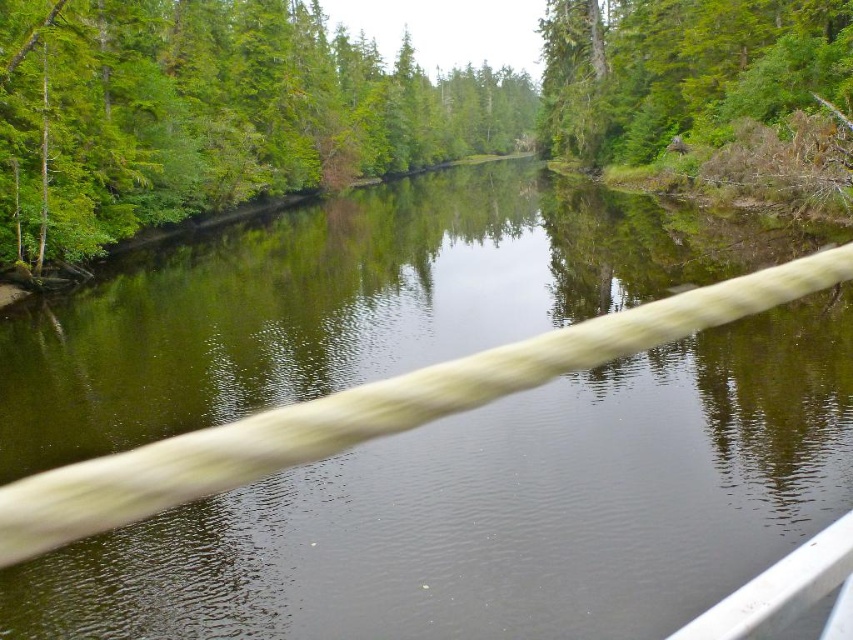
Is green leafy tree at upper left wider than green rough bark tree at upper right?

Indeed, green leafy tree at upper left has a greater width compared to green rough bark tree at upper right.

You are a GUI agent. You are given a task and a screenshot of the screen. Output one action in this format:
    pyautogui.click(x=<x>, y=<y>)
    Task: Click on the green leafy tree at upper left
    This screenshot has height=640, width=853.
    Given the screenshot: What is the action you would take?
    coord(212,115)

The width and height of the screenshot is (853, 640). In order to click on green leafy tree at upper left in this screenshot , I will do [212, 115].